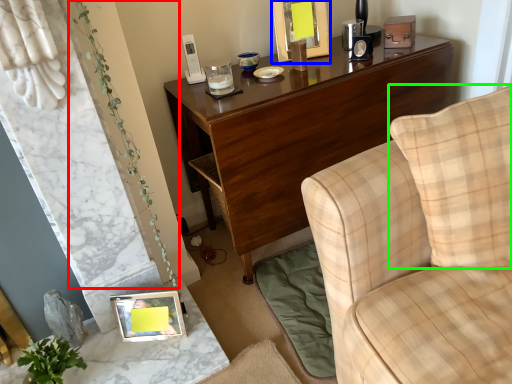
Question: Which object is positioned farthest from plant (highlighted by a red box)? Select from picture frame (highlighted by a blue box) and pillow (highlighted by a green box).

Choices:
 (A) picture frame
 (B) pillow

Answer: (A)